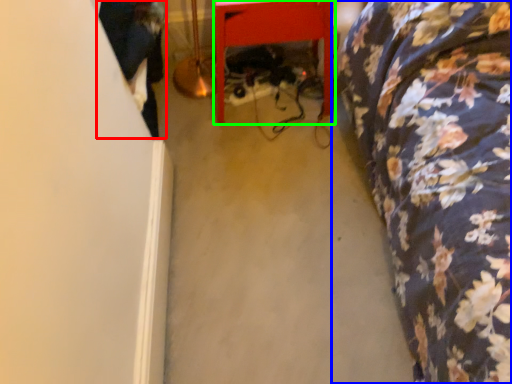
Question: Considering the real-world distances, which object is farthest from couple (highlighted by a red box)? furniture (highlighted by a blue box) or furniture (highlighted by a green box)?

Choices:
 (A) furniture
 (B) furniture

Answer: (A)